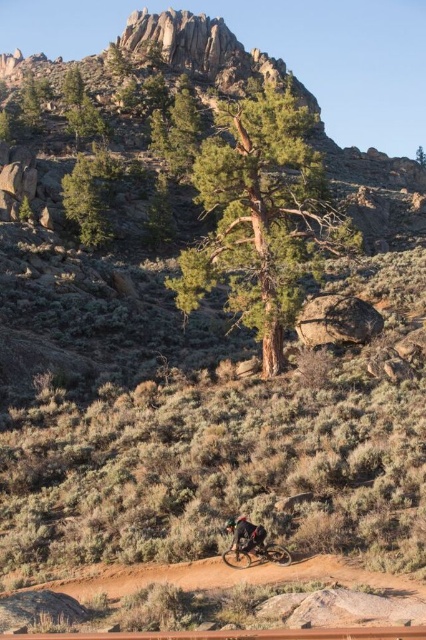
Question: Which of the following is the farthest from the observer?

Choices:
 (A) rugged granite mountain at upper center
 (B) brown dirt track at lower center

Answer: (A)

Question: Is green textured tree at center positioned in front of rugged granite mountain at upper center?

Choices:
 (A) no
 (B) yes

Answer: (B)

Question: Which object is positioned closest to the green matte tree at upper left?

Choices:
 (A) green textured tree at center
 (B) brown dirt track at lower center
 (C) shiny metallic bicycle at lower center
 (D) rugged granite mountain at upper center

Answer: (A)

Question: Is brown dirt track at lower center to the right of shiny metallic bicycle at lower center from the viewer's perspective?

Choices:
 (A) yes
 (B) no

Answer: (B)

Question: Can you confirm if rugged granite mountain at upper center is positioned above green matte tree at upper left?

Choices:
 (A) no
 (B) yes

Answer: (B)

Question: Which point appears farthest from the camera in this image?

Choices:
 (A) (345, 218)
 (B) (97, 228)
 (C) (230, 557)
 (D) (276, 60)

Answer: (D)